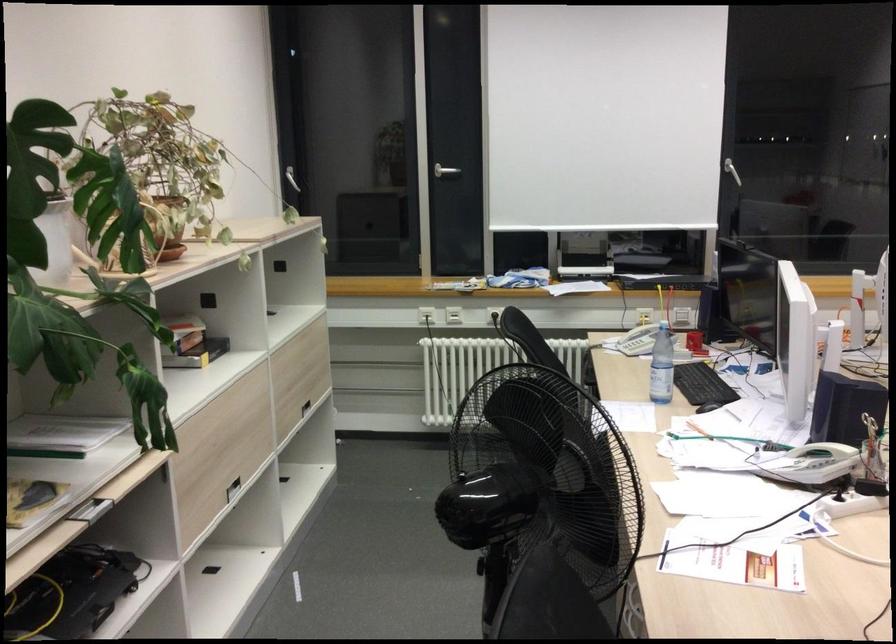
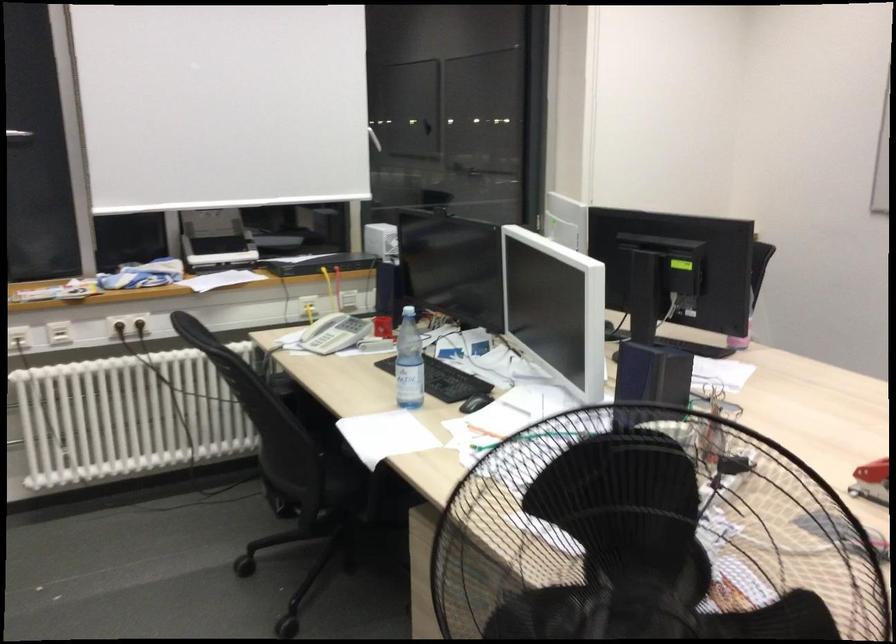
Question: How did the camera likely rotate?

Choices:
 (A) Left
 (B) Right
 (C) Up
 (D) Down

Answer: (B)